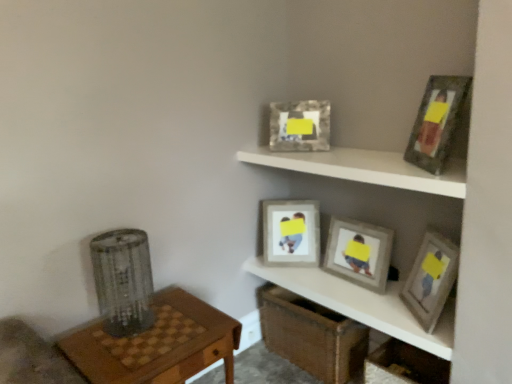
You are a GUI agent. You are given a task and a screenshot of the screen. Output one action in this format:
    pyautogui.click(x=<x>, y=<y>)
    Task: Click on the free point above wooden at left (from a real-world perspective)
    
    Given the screenshot: What is the action you would take?
    pyautogui.click(x=148, y=334)